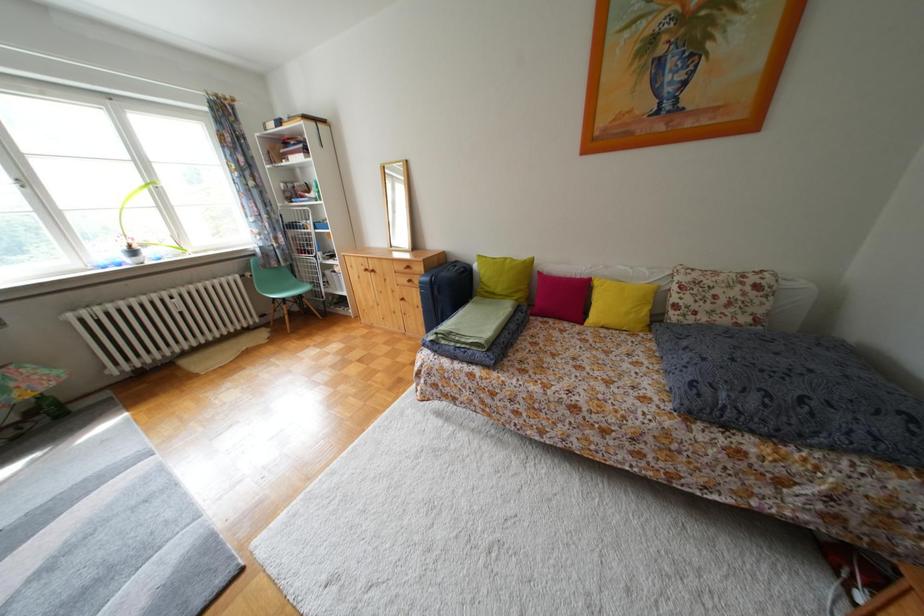
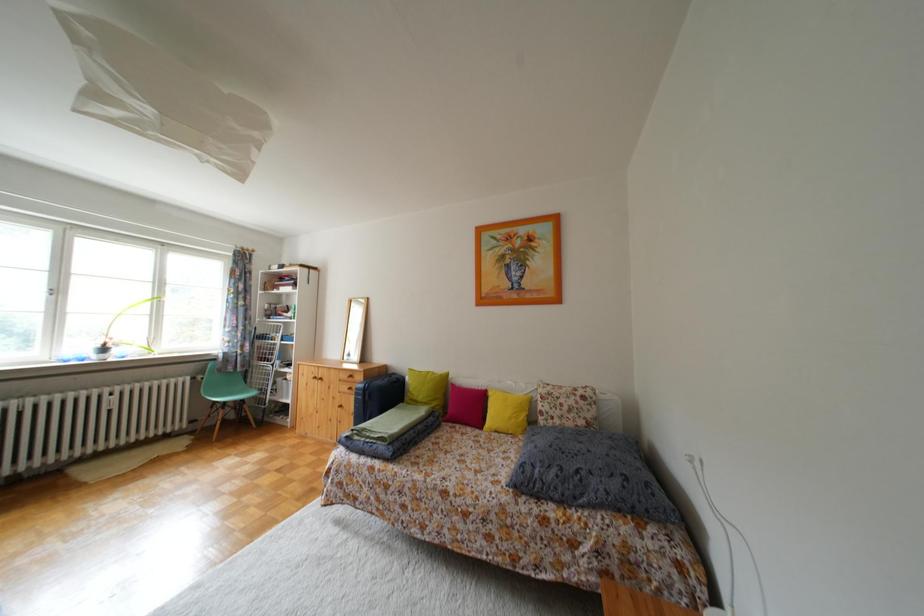
What movement of the cameraman would produce the second image?

The cameraman moved toward right, backward.